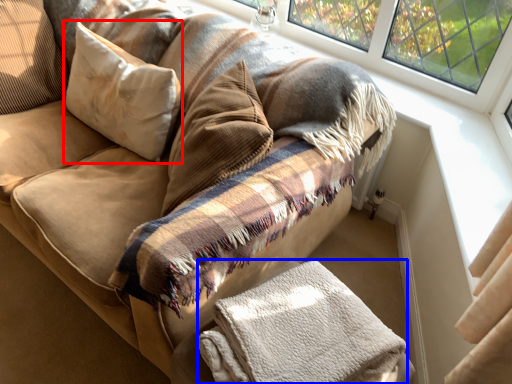
Question: Which point is closer to the camera, pillow (highlighted by a red box) or material (highlighted by a blue box)?

Choices:
 (A) pillow
 (B) material

Answer: (B)